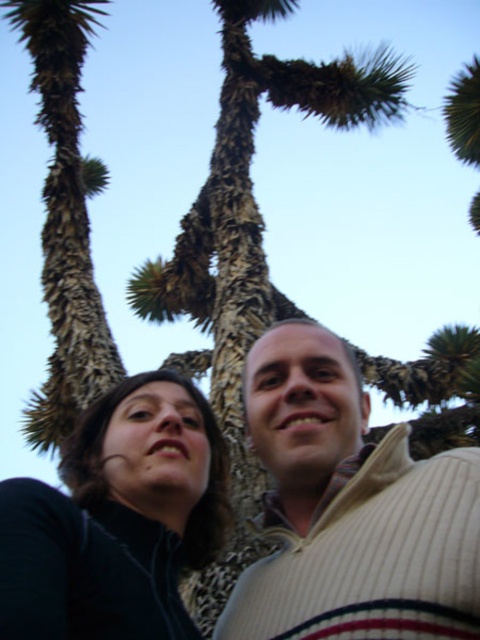
Question: Can you confirm if dark brown sweater at center is positioned to the left of brown textured trunk at left?

Choices:
 (A) yes
 (B) no

Answer: (B)

Question: Which of these objects is positioned farthest from the brown textured trunk at left?

Choices:
 (A) dark brown sweater at center
 (B) black matte jacket at lower left

Answer: (A)

Question: Does black matte jacket at lower left have a larger size compared to brown textured trunk at left?

Choices:
 (A) no
 (B) yes

Answer: (A)

Question: Considering the relative positions of black matte jacket at lower left and brown textured trunk at left in the image provided, where is black matte jacket at lower left located with respect to brown textured trunk at left?

Choices:
 (A) above
 (B) below

Answer: (B)

Question: Among these points, which one is farthest from the camera?

Choices:
 (A) (72, 374)
 (B) (156, 444)
 (C) (177, 486)

Answer: (A)

Question: Which point is closer to the camera?

Choices:
 (A) dark brown sweater at center
 (B) black matte jacket at lower left

Answer: (B)